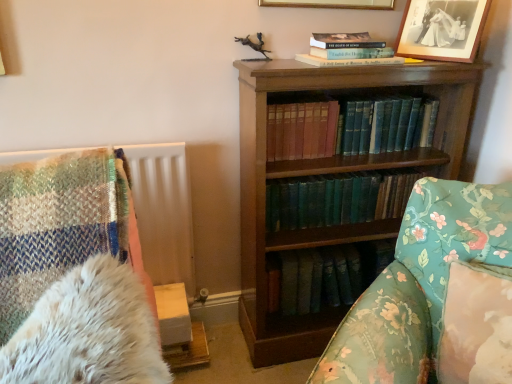
Question: In the image, is teal leather book at center, acting as the 1th book starting from the top, on the left side or the right side of green leather book at center, the 1th book from the bottom?

Choices:
 (A) left
 (B) right

Answer: (B)

Question: Based on their sizes in the image, would you say teal leather book at center, acting as the 1th book starting from the top, is bigger or smaller than green leather book at center, placed as the second book when sorted from top to bottom?

Choices:
 (A) small
 (B) big

Answer: (B)

Question: Which object is positioned farthest from the gold-framed picture at upper center, acting as the first picture frame starting from the left?

Choices:
 (A) dark green leather bookshelf at center
 (B) white fur at lower left
 (C) wooden bookcase at center
 (D) black matte picture frame at upper right, the second picture frame positioned from the left
 (E) teal leather book at center, arranged as the second book when ordered from the bottom

Answer: (B)

Question: Estimate the real-world distances between objects in this image. Which object is closer to the green leather book at center, the 1th book from the bottom?

Choices:
 (A) white fur at lower left
 (B) gold-framed picture at upper center, which appears as the second picture frame when viewed from the right
 (C) wooden bookcase at center
 (D) black matte picture frame at upper right, the second picture frame positioned from the left
 (E) dark green leather bookshelf at center

Answer: (C)